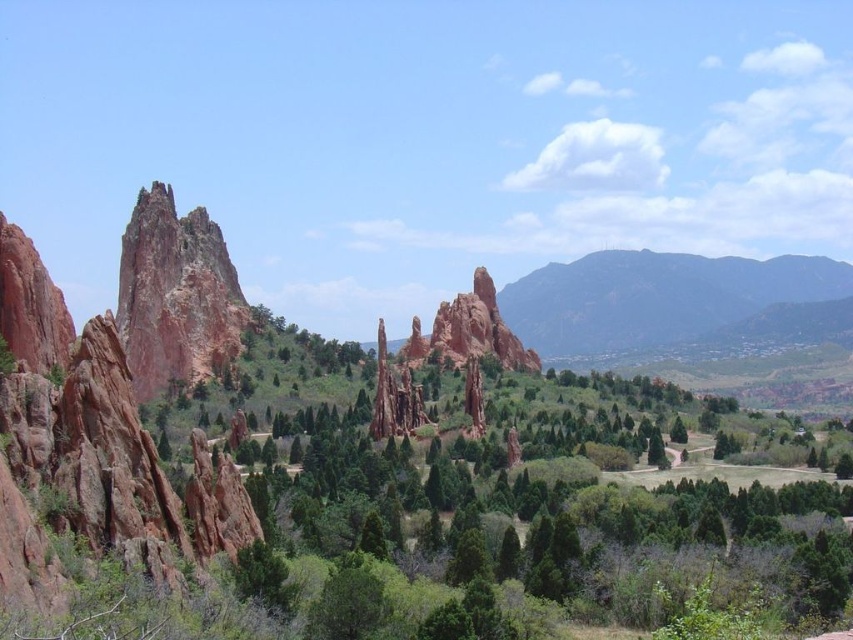
You are standing in the Garden of the Gods and see two points marked on the ground. One is labeled as point (582,333) and the other as point (379,346). If you are facing north, which point is closer to you?

Point (379,346) is closer to you because it is in front of point (582,333).

From the picture: You are standing at the center of the Garden of the Gods and want to take a photo of the dark gray rocky mountain at right. Which direction should you face to capture it in your frame?

The dark gray rocky mountain at right is located at coordinates point (654, 298), which means it is positioned to the right and slightly forward from your current position. To capture it in your frame, you should face towards the right side of the scene.

You are planning a photography shoot and need to position your camera to capture both the dark gray rocky mountain at right and the rustic sandstone spire at center. Given their sizes, which object should you focus on first to ensure it fits in the frame?

The dark gray rocky mountain at right is larger in size than the rustic sandstone spire at center, so you should focus on capturing the dark gray rocky mountain at right first to ensure it fits in the frame.